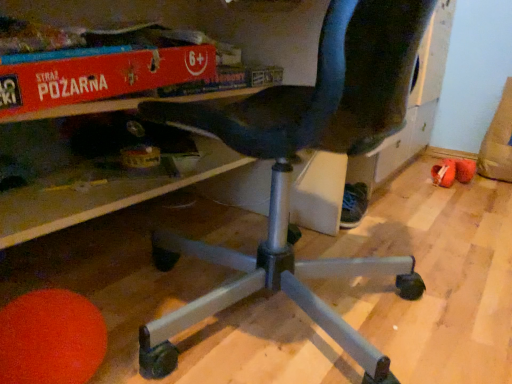
Find the location of a particular element. vacant area that lies to the right of black fabric shoe at lower center, which ranks as the first footwear in front-to-back order is located at coordinates (399, 222).